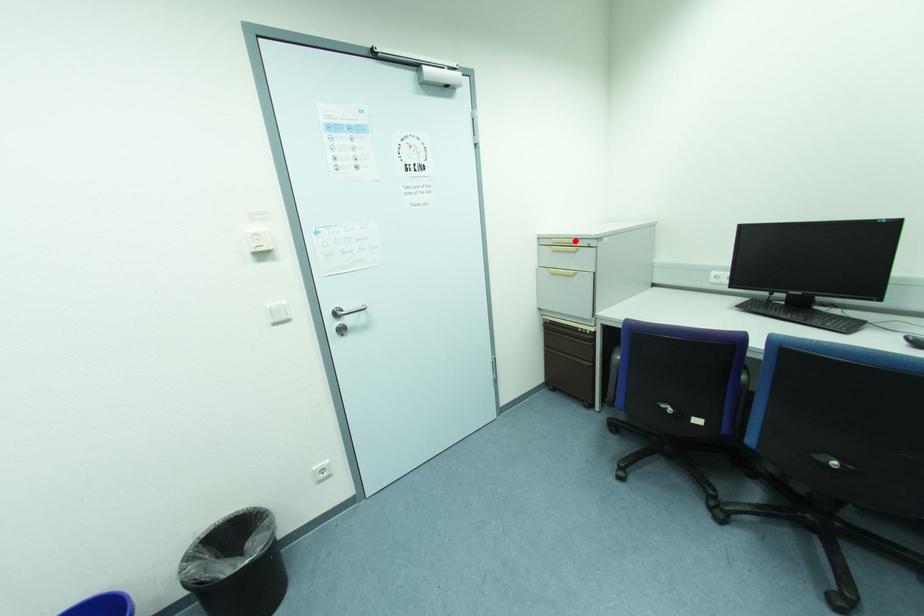
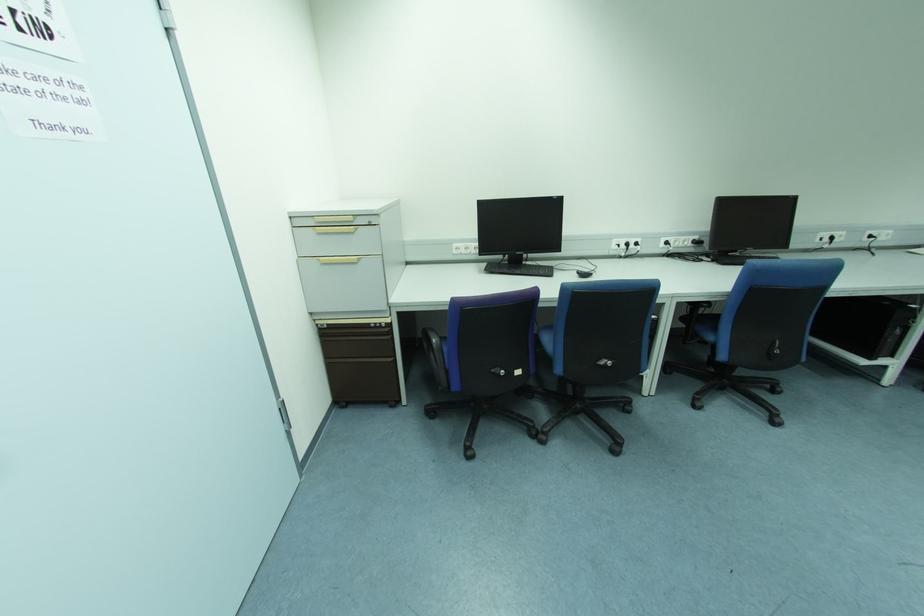
The point at the highlighted location is marked in the first image. Where is the corresponding point in the second image?

(350, 219)